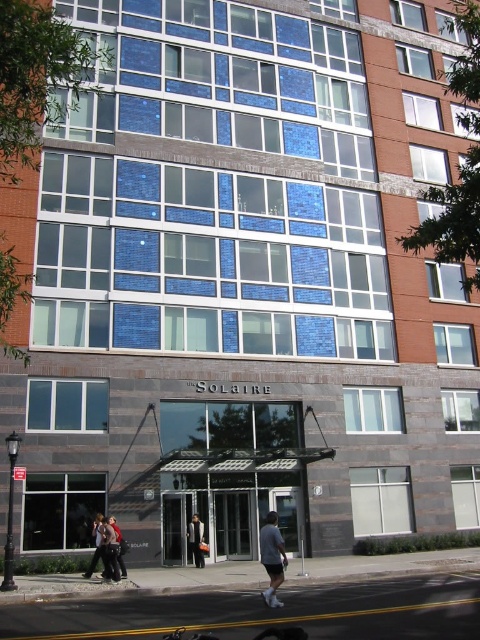
Who is more distant from viewer, (4, 634) or (286, 561)?

Point (286, 561)

Can you confirm if gray asphalt at lower center is positioned above gray cotton shirt at center?

Yes, gray asphalt at lower center is above gray cotton shirt at center.

Who is more forward, (334, 579) or (264, 547)?

Point (264, 547) is in front.

Locate an element on the screen. The image size is (480, 640). gray asphalt at lower center is located at coordinates (264, 609).

Between gray asphalt at lower center and dark gray fabric jacket at center, which one appears on the right side from the viewer's perspective?

From the viewer's perspective, gray asphalt at lower center appears more on the right side.

Identify the location of gray asphalt at lower center. (264, 609).

This screenshot has width=480, height=640. What are the coordinates of `gray asphalt at lower center` in the screenshot? It's located at (264, 609).

Locate an element on the screen. The width and height of the screenshot is (480, 640). gray cotton shirt at center is located at coordinates (272, 557).

Which is in front, point (277, 600) or point (112, 561)?

Positioned in front is point (277, 600).

Is point (268, 570) in front of point (118, 547)?

Yes, point (268, 570) is closer to viewer.

This screenshot has height=640, width=480. I want to click on gray cotton shirt at center, so click(272, 557).